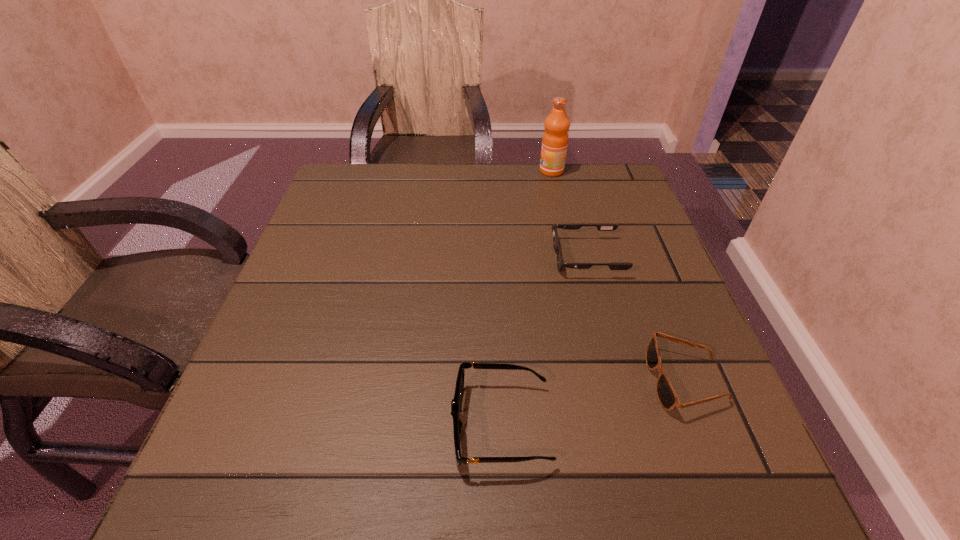
The image size is (960, 540). What are the coordinates of `free region located on the front-facing side of the leftmost object` in the screenshot? It's located at (247, 426).

You are a GUI agent. You are given a task and a screenshot of the screen. Output one action in this format:
    pyautogui.click(x=<x>, y=<y>)
    Task: Click on the free space located on the temples of the farthest sunglasses
    This screenshot has width=960, height=540.
    Given the screenshot: What is the action you would take?
    pyautogui.click(x=448, y=258)

In order to click on vacant space situated 0.180m on the temples of the farthest sunglasses in this screenshot , I will do `click(471, 258)`.

Image resolution: width=960 pixels, height=540 pixels. I want to click on free space located 0.220m on the temples of the farthest sunglasses, so click(x=453, y=258).

The height and width of the screenshot is (540, 960). Identify the location of object at the far edge. (555, 138).

Identify the location of object positioned at the near edge. The image size is (960, 540). (456, 402).

Locate an element on the screen. free space at the far edge of the desktop is located at coordinates (545, 213).

At what (x,y) coordinates should I click in order to perform the action: click on free space at the near edge. Please return your answer as a coordinate pair (x, y). The image size is (960, 540). Looking at the image, I should click on (636, 457).

You are a GUI agent. You are given a task and a screenshot of the screen. Output one action in this format:
    pyautogui.click(x=<x>, y=<y>)
    Task: Click on the vacant area at the left edge
    The height and width of the screenshot is (540, 960).
    Given the screenshot: What is the action you would take?
    pyautogui.click(x=328, y=250)

The width and height of the screenshot is (960, 540). I want to click on free location at the right edge of the desktop, so click(655, 276).